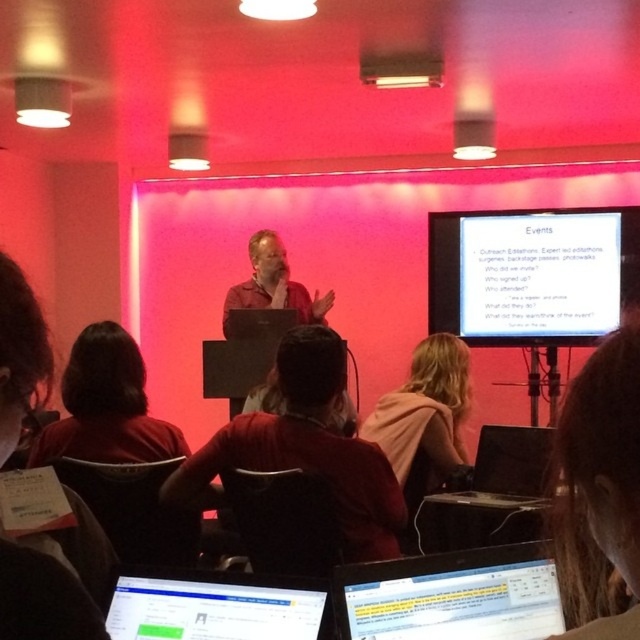
Can you confirm if dark red shirt at center is thinner than pink fabric at center?

Incorrect, dark red shirt at center's width is not less than pink fabric at center's.

Which of these two, dark red shirt at center or pink fabric at center, stands shorter?

pink fabric at center is shorter.

Image resolution: width=640 pixels, height=640 pixels. Find the location of `dark red shirt at center`. dark red shirt at center is located at coordinates (307, 449).

Which is above, matte black laptop at lower center or pink fabric at center?

pink fabric at center

Which is behind, point (154, 637) or point (410, 442)?

Point (410, 442)

Measure the distance between matte black laptop at lower center and camera.

A distance of 1.03 meters exists between matte black laptop at lower center and camera.

Identify the location of matte black laptop at lower center. The height and width of the screenshot is (640, 640). (214, 605).

Who is more distant from viewer, [616,461] or [67,385]?

Positioned behind is point [67,385].

Is blonde hair at upper right wider than dark red shirt at lower left?

Incorrect, blonde hair at upper right's width does not surpass dark red shirt at lower left's.

Identify the location of blonde hair at upper right. This screenshot has height=640, width=640. pyautogui.click(x=600, y=477).

Find the location of a particular element. This screenshot has width=640, height=640. blonde hair at upper right is located at coordinates (600, 477).